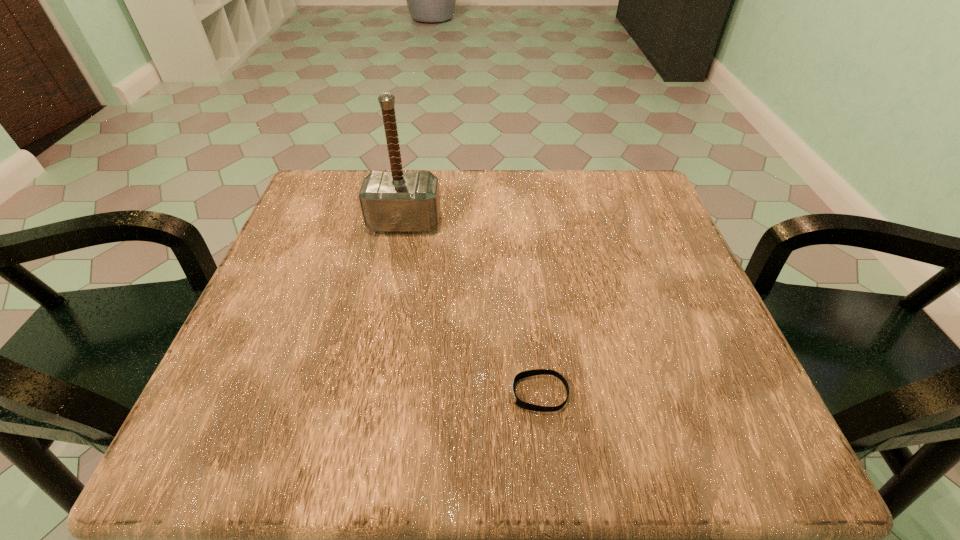
Identify the location of the farther object. This screenshot has height=540, width=960. (396, 201).

Identify the location of the taller object. pyautogui.click(x=396, y=201).

The image size is (960, 540). I want to click on the shorter object, so click(529, 373).

Find the location of `wristband`. wristband is located at coordinates (529, 373).

At what (x,y) coordinates should I click in order to perform the action: click on vacant space located 0.280m on the front of the farther object. Please return your answer as a coordinate pair (x, y). Looking at the image, I should click on (381, 343).

The image size is (960, 540). I want to click on vacant space situated on the display of the shorter object, so click(407, 394).

I want to click on vacant area situated 0.110m on the display of the shorter object, so click(x=439, y=394).

At what (x,y) coordinates should I click in order to perform the action: click on free space located on the display of the shorter object. Please return your answer as a coordinate pair (x, y). The image size is (960, 540). Looking at the image, I should click on (256, 394).

The width and height of the screenshot is (960, 540). Find the location of `object situated at the far edge`. object situated at the far edge is located at coordinates (396, 201).

This screenshot has width=960, height=540. I want to click on object that is at the near edge, so click(529, 373).